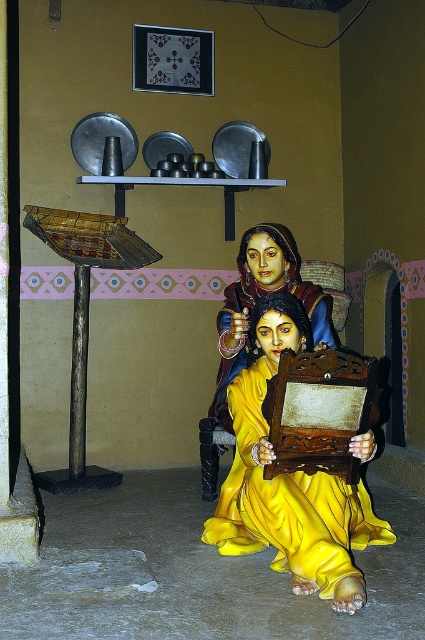
You are an archaeologist examining a historical painting. You notice two points marked on the image at coordinates point (x=235, y=387) and point (x=326, y=296). Based on the scene, which point is closer to the viewer?

Point (x=235, y=387) is in front of point (x=326, y=296), so the first point is closer to the viewer.

You are an interior designer observing the statue of two women in the room. You notice the yellow satin fabric at center and the satin yellow dress at center. Which one is positioned closer to the front of the scene?

The yellow satin fabric at center is closer to the viewer than the satin yellow dress at center, so the yellow satin fabric at center is positioned closer to the front of the scene.

You are an interior designer planning to place a new sofa in this room. You have two items to consider from the scene, the yellow satin fabric at center and the satin yellow dress at center. Which item is located to the right of the other?

The yellow satin fabric at center is positioned on the right side of the satin yellow dress at center, so it is located to the right of the dress.